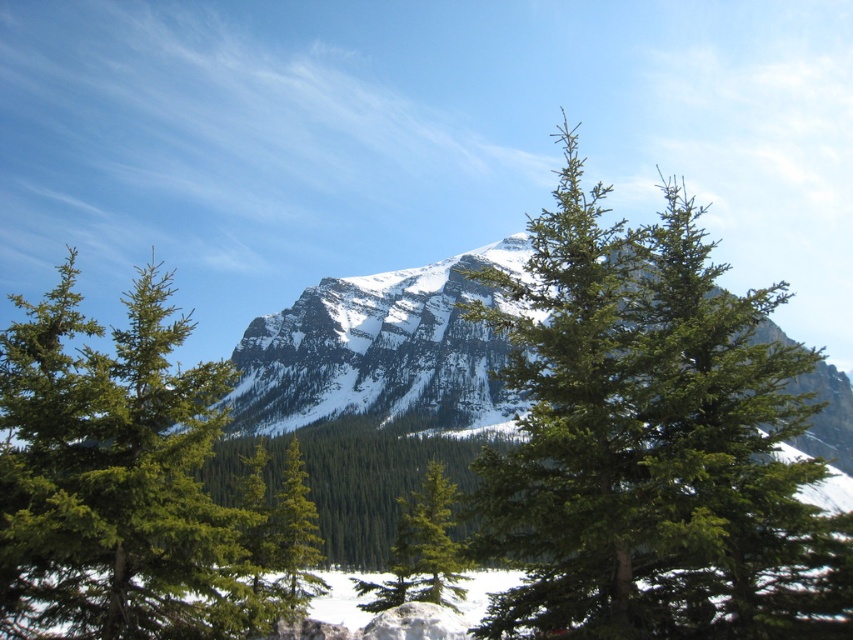
Question: Estimate the real-world distances between objects in this image. Which object is farther from the green needle-like at center?

Choices:
 (A) snowy granite mountain at center
 (B) green matte tree at center
 (C) green needle-like tree at center

Answer: (A)

Question: Is green needle-like tree at center bigger than green needle-like at center?

Choices:
 (A) yes
 (B) no

Answer: (A)

Question: Observing the image, what is the correct spatial positioning of green needle-like tree at center in reference to green matte tree at center?

Choices:
 (A) left
 (B) right

Answer: (B)

Question: From the image, what is the correct spatial relationship of green needle-like tree at center in relation to snowy granite mountain at center?

Choices:
 (A) left
 (B) right

Answer: (B)

Question: Which object appears closest to the camera in this image?

Choices:
 (A) green matte tree at center
 (B) green needle-like at center

Answer: (B)

Question: Which of the following is the closest to the observer?

Choices:
 (A) green matte tree at center
 (B) green needle-like at center

Answer: (B)